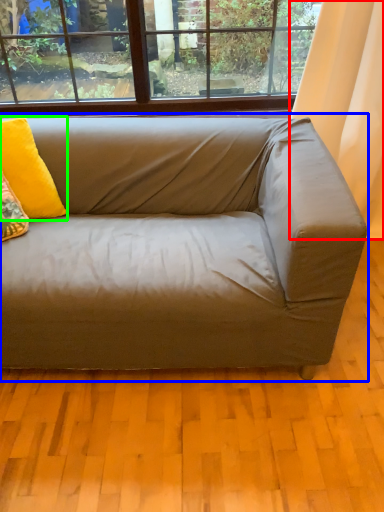
Question: Which object is positioned closest to curtain (highlighted by a red box)? Select from studio couch (highlighted by a blue box) and pillow (highlighted by a green box).

Choices:
 (A) studio couch
 (B) pillow

Answer: (A)